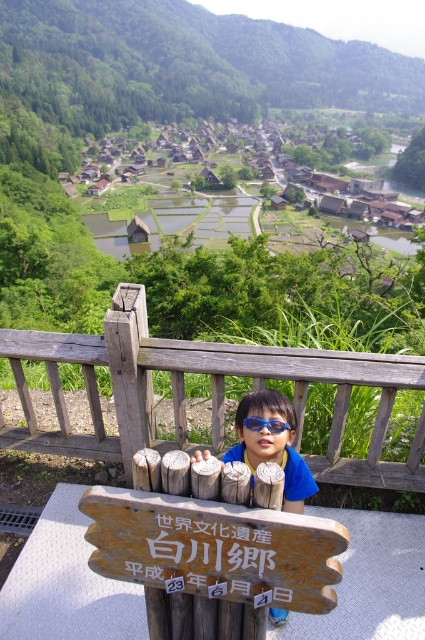
You are standing at the center of the wooden railing overlooking the Hakuba Village. There is a weathered wood at center located at point (212, 392). If you want to touch the weathered wood at center, where should you move your hand relative to your current position?

The weathered wood at center is located at point (212, 392), so you should move your hand to that specific coordinate to touch it.

In the scene shown: You are a tourist at the Hakuba Village overlook. You notice the weathered wood at center and the blue plastic goggles at center. Which object is higher in this scene?

The weathered wood at center is taller than the blue plastic goggles at center.

You are a tourist standing at the scenic overlook in Hakuba Village. You notice the weathered wood at center and the blue plastic sunglasses at center. Which object is closer to your viewpoint?

The weathered wood at center is positioned over the blue plastic sunglasses at center, so the weathered wood at center is closer to your viewpoint.